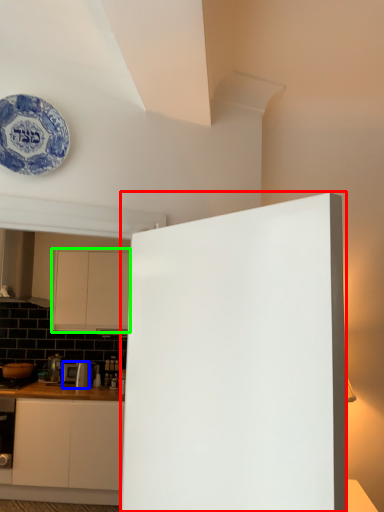
Question: Considering the real-world distances, which object is closest to door (highlighted by a red box)? appliance (highlighted by a blue box) or cabinetry (highlighted by a green box).

Choices:
 (A) appliance
 (B) cabinetry

Answer: (B)